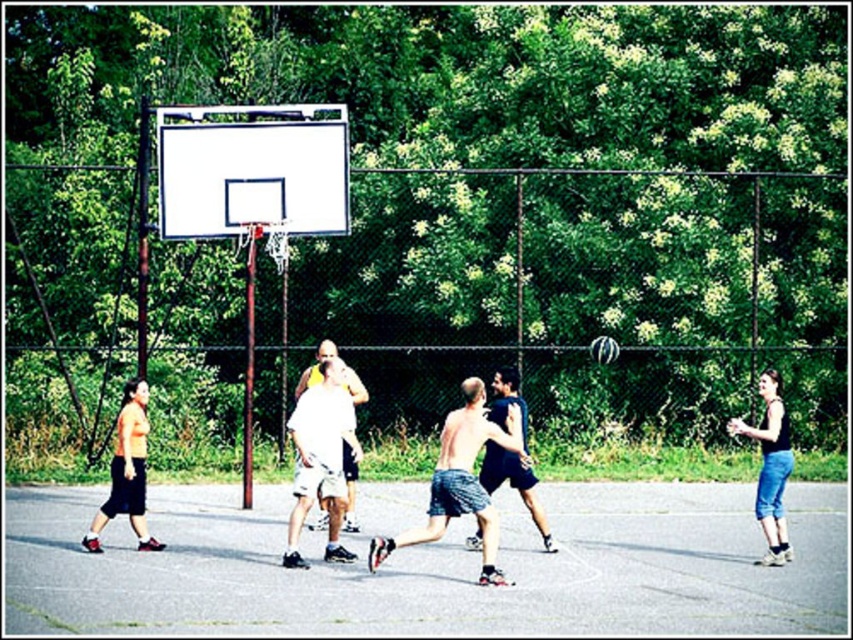
Question: Can you confirm if white plastic basketball hoop at center is positioned to the left of black tank top at right?

Choices:
 (A) yes
 (B) no

Answer: (A)

Question: Among these objects, which one is nearest to the camera?

Choices:
 (A) orange shirt at left
 (B) skinny jeans at center
 (C) dark blue shorts at center

Answer: (B)

Question: In this image, where is skinny jeans at center located relative to orange shirt at left?

Choices:
 (A) above
 (B) below

Answer: (B)

Question: Does orange shirt at left come in front of black tank top at right?

Choices:
 (A) yes
 (B) no

Answer: (B)

Question: Which object appears farthest from the camera in this image?

Choices:
 (A) black tank top at right
 (B) white matte basketball player at center
 (C) orange shirt at left
 (D) white plastic basketball hoop at center

Answer: (D)

Question: Which object appears closest to the camera in this image?

Choices:
 (A) skinny jeans at center
 (B) gray asphalt court at center
 (C) black tank top at right

Answer: (B)